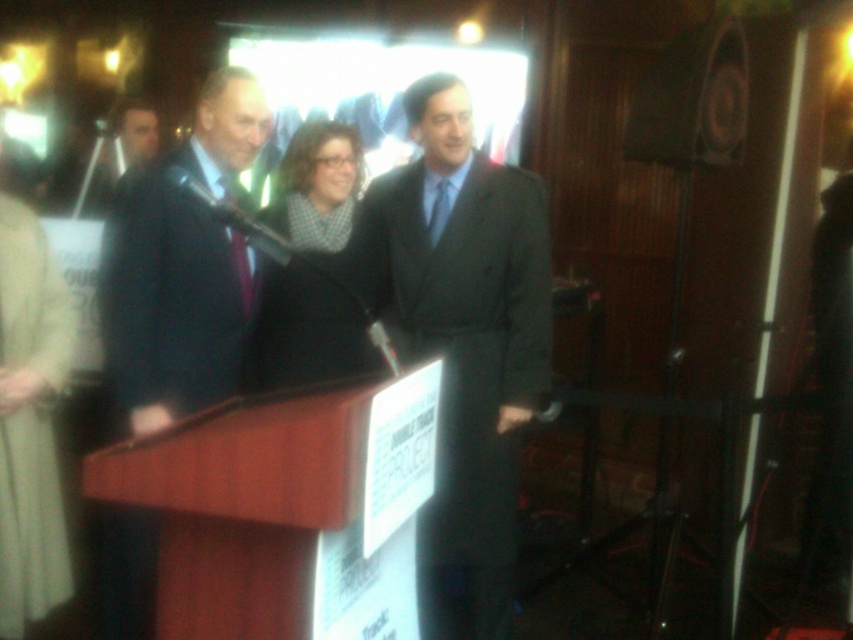
You are organizing a small event and need to place a decorative item on the podium. The black wool scarf at center and the matte black speaker at upper right are available. Which item can you place on the podium without it hanging off the edge?

The black wool scarf at center has a larger size compared to matte black speaker at upper right, so the speaker will fit better on the podium without hanging off the edge.